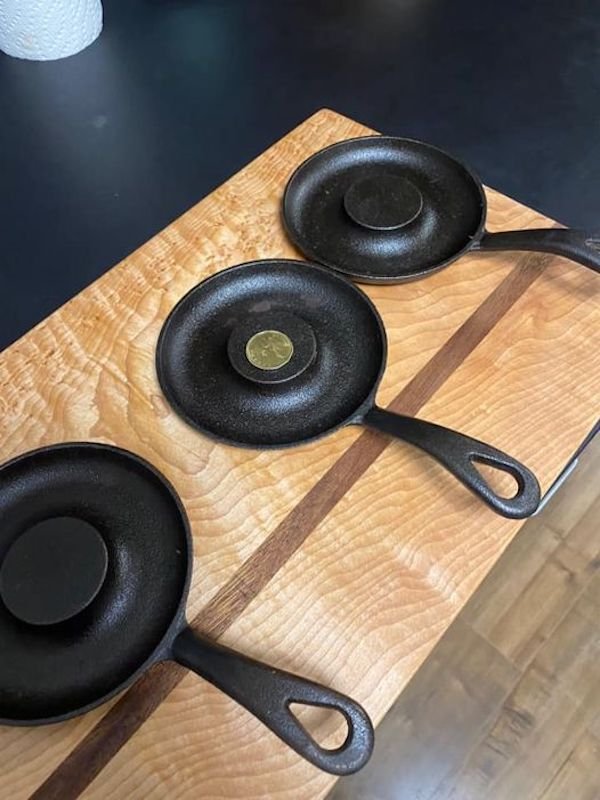
Find the location of a particular element. This screenshot has width=600, height=800. wood surface is located at coordinates (542, 688).